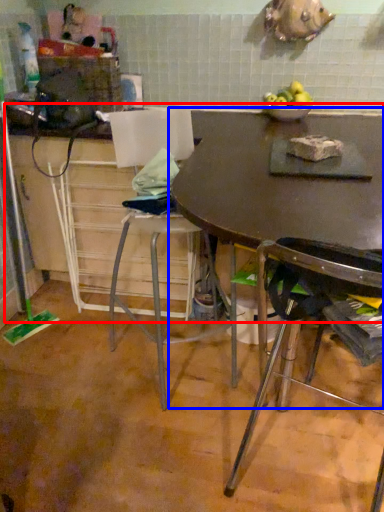
Question: Among these objects, which one is farthest to the camera, counter top (highlighted by a red box) or table (highlighted by a blue box)?

Choices:
 (A) counter top
 (B) table

Answer: (A)